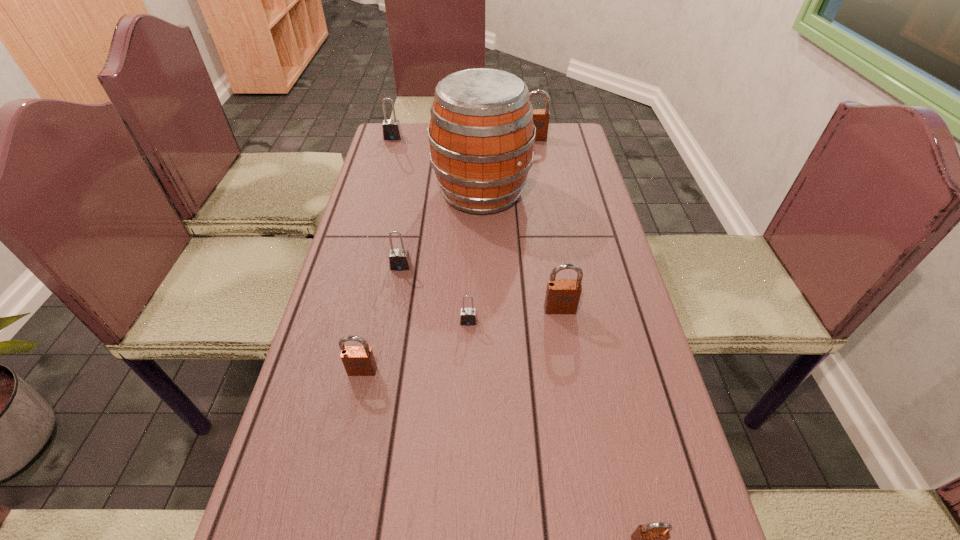
The width and height of the screenshot is (960, 540). I want to click on the tallest object, so 481,133.

At what (x,y) coordinates should I click in order to perform the action: click on cider. Please return your answer as a coordinate pair (x, y). Looking at the image, I should click on (481, 133).

Find the location of a particular element. The height and width of the screenshot is (540, 960). the seventh shortest object is located at coordinates (541, 117).

Locate an element on the screen. the biggest brown padlock is located at coordinates (541, 117).

In order to click on the leftmost padlock in this screenshot , I will do `click(391, 128)`.

Identify the location of the leftmost gray padlock. The image size is (960, 540). (391, 128).

You are a GUI agent. You are given a task and a screenshot of the screen. Output one action in this format:
    pyautogui.click(x=<x>, y=<y>)
    Task: Click on the second farthest brown padlock
    This screenshot has height=540, width=960.
    Given the screenshot: What is the action you would take?
    pyautogui.click(x=562, y=296)

Find the location of a particular element. The image size is (960, 540). the fourth farthest padlock is located at coordinates (562, 296).

The height and width of the screenshot is (540, 960). I want to click on the third farthest padlock, so click(x=399, y=259).

You are a GUI agent. You are given a task and a screenshot of the screen. Output one action in this format:
    pyautogui.click(x=<x>, y=<y>)
    Task: Click on the second farthest gray padlock
    
    Given the screenshot: What is the action you would take?
    point(399,259)